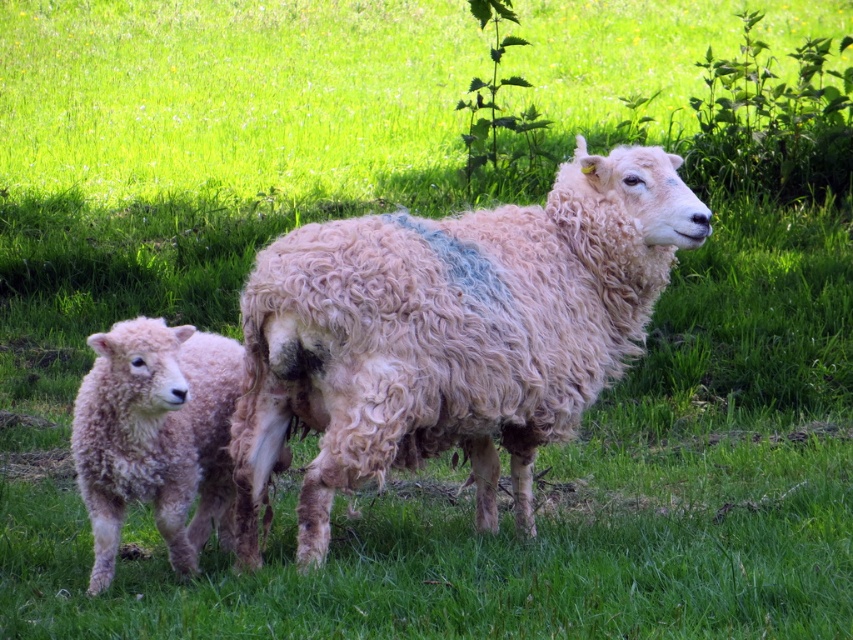
Is curly woolen sheep at center to the right of fuzzy woolen lamb at left from the viewer's perspective?

Indeed, curly woolen sheep at center is positioned on the right side of fuzzy woolen lamb at left.

Can you confirm if curly woolen sheep at center is smaller than fuzzy woolen lamb at left?

Actually, curly woolen sheep at center might be larger than fuzzy woolen lamb at left.

Does point (260, 445) come closer to viewer compared to point (219, 440)?

Yes, it is in front of point (219, 440).

Where is `curly woolen sheep at center`? curly woolen sheep at center is located at coordinates (451, 333).